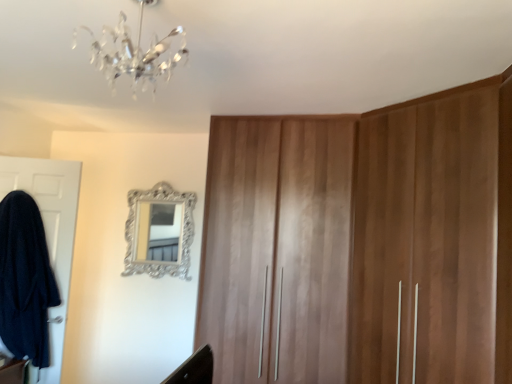
Question: Is crystal glass chandelier at upper center in front of or behind silver ornate mirror at upper center in the image?

Choices:
 (A) behind
 (B) front

Answer: (B)

Question: Choose the correct answer: Is crystal glass chandelier at upper center inside silver ornate mirror at upper center or outside it?

Choices:
 (A) inside
 (B) outside

Answer: (B)

Question: Estimate the real-world distances between objects in this image. Which object is closer to the wooden wardrobe at center?

Choices:
 (A) white matte door at left
 (B) silver ornate mirror at upper center
 (C) crystal glass chandelier at upper center

Answer: (B)

Question: Based on their relative distances, which object is farther from the white matte door at left?

Choices:
 (A) silver ornate mirror at upper center
 (B) crystal glass chandelier at upper center
 (C) wooden wardrobe at center

Answer: (B)